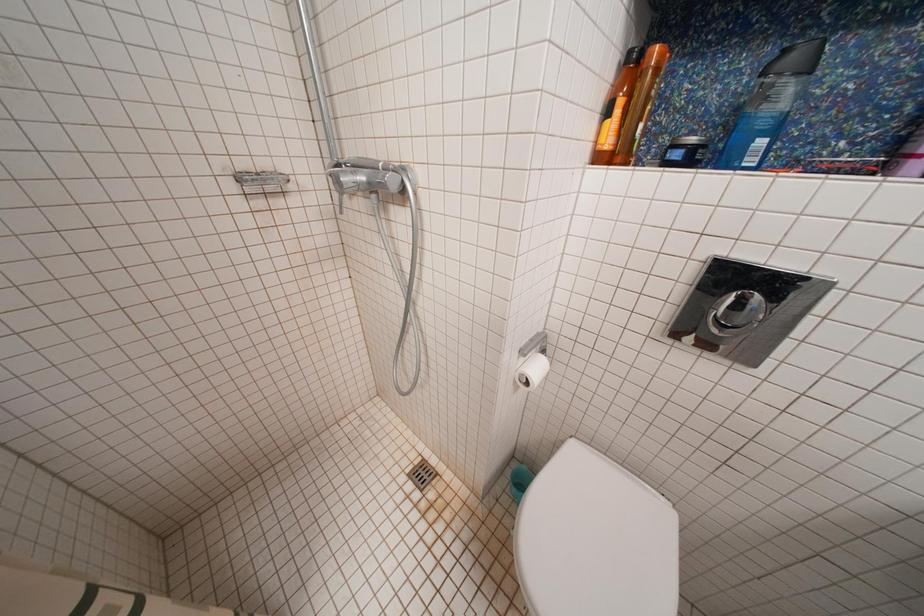
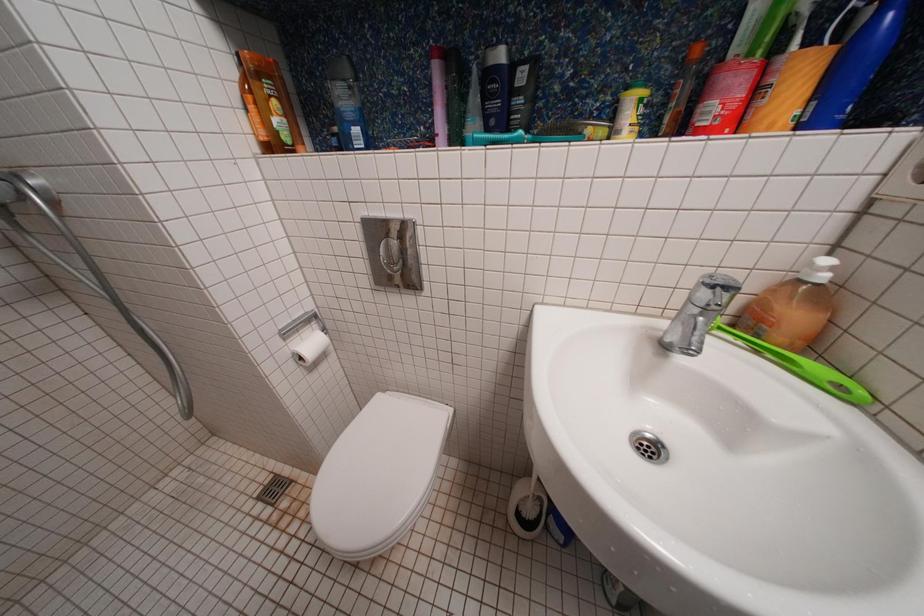
In a continuous first-person perspective shot, in which direction is the camera moving?

The movement direction of the cameraman is right, backward.